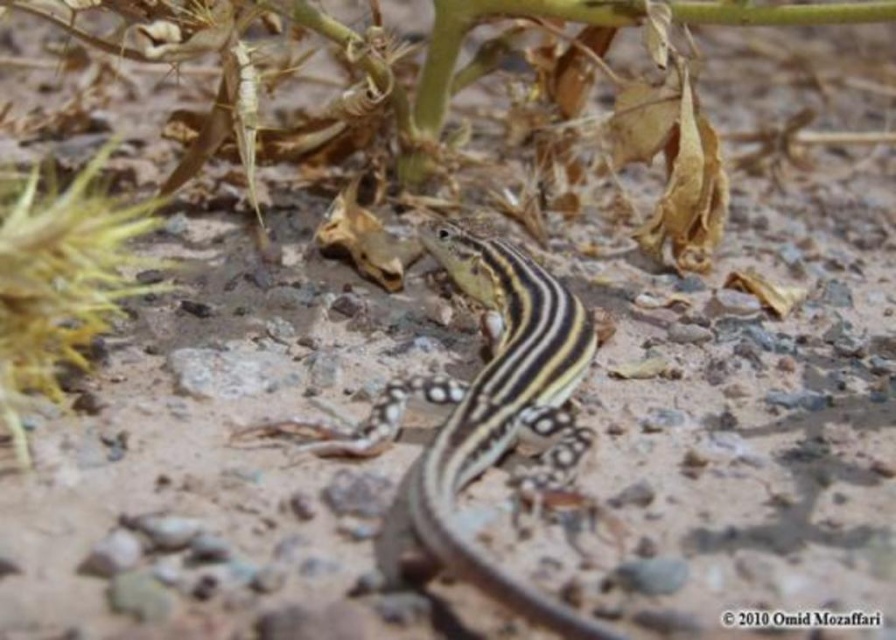
Is yellow striped lizard at center to the right of yellow fuzzy plant at left from the viewer's perspective?

Correct, you'll find yellow striped lizard at center to the right of yellow fuzzy plant at left.

Is yellow striped lizard at center to the left of yellow fuzzy plant at left from the viewer's perspective?

In fact, yellow striped lizard at center is to the right of yellow fuzzy plant at left.

Is point (435, 554) behind point (66, 211)?

That is True.

This screenshot has height=640, width=896. I want to click on yellow striped lizard at center, so click(x=487, y=410).